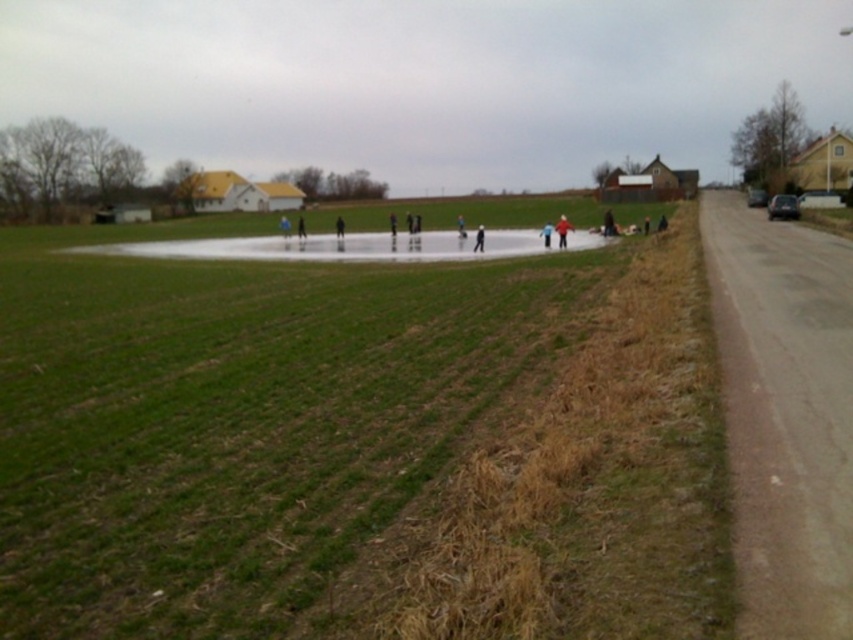
You are standing at the point marked as point (x=657, y=442) and you want to throw a ball to your friend who is standing at the other end of the field. If the ball can travel a maximum distance of 20 feet, will you be able to reach your friend?

The distance between you and your friend at point (x=657, y=442) is 21.48 feet, which is greater than the ball can travel. So you won not be able to reach your friend.

You are standing in the middle of the field and see the green grass at center and the light blue fabric jacket at center. Which one is wider?

The green grass at center is wider than the light blue fabric jacket at center.

You are standing in the rural field and see the green grass at center and the light blue fabric jacket at center. Which object is closer to the ground?

The green grass at center is closer to the ground because it is located below the light blue fabric jacket at center.